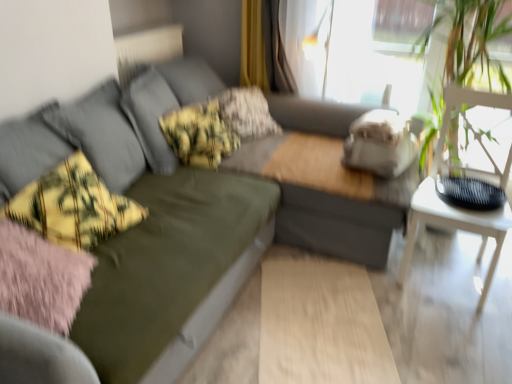
Measure the distance between point (417, 197) and camera.

Point (417, 197) is 2.08 meters from camera.

You are a GUI agent. You are given a task and a screenshot of the screen. Output one action in this format:
    pyautogui.click(x=<x>, y=<y>)
    Task: Click on the yellow-green plaid throw pillow at left
    
    Given the screenshot: What is the action you would take?
    pyautogui.click(x=73, y=206)

Describe the element at coordinates (72, 142) in the screenshot. I see `olive green fabric couch at center` at that location.

What is the approximate height of olive green fabric couch at center?

olive green fabric couch at center is 37.23 inches tall.

In order to face floral fabric pillow at center, acting as the 1th pillow starting from the back, should I rotate leftwards or rightwards?

You should look left and rotate roughly 1.478 degrees.

This screenshot has height=384, width=512. I want to click on yellow-green plaid pillow at center, which is the 2th pillow from back to front, so click(x=199, y=134).

What do you see at coordinates (264, 48) in the screenshot? I see `yellow fabric curtain at upper center` at bounding box center [264, 48].

The image size is (512, 384). I want to click on white wooden table at right, so click(455, 227).

Is yellow fabric curtain at upper center bigger than white textured radiator at upper left?

No.

Can you tell me how much yellow fabric curtain at upper center and white textured radiator at upper left differ in facing direction?

The angle between the facing direction of yellow fabric curtain at upper center and the facing direction of white textured radiator at upper left is 88.9 degrees.

Does yellow fabric curtain at upper center have a greater height compared to white textured radiator at upper left?

Indeed, yellow fabric curtain at upper center has a greater height compared to white textured radiator at upper left.

This screenshot has height=384, width=512. Find the location of `the 2nd pillow below when counting from the white textured radiator at upper left (from the image's perspective)`. the 2nd pillow below when counting from the white textured radiator at upper left (from the image's perspective) is located at coordinates (199, 134).

Which of these two, white textured radiator at upper left or yellow-green plaid pillow at center, which is the 2th pillow from back to front, is wider?

Wider between the two is yellow-green plaid pillow at center, which is the 2th pillow from back to front.

Is white textured radiator at upper left turned away from yellow-green plaid pillow at center, the 1th pillow in the front-to-back sequence?

No, white textured radiator at upper left's orientation is not away from yellow-green plaid pillow at center, the 1th pillow in the front-to-back sequence.

Does white textured radiator at upper left have a larger size compared to yellow-green plaid pillow at center, which is the 2th pillow from back to front?

No, white textured radiator at upper left is not bigger than yellow-green plaid pillow at center, which is the 2th pillow from back to front.

Which of these two, olive green fabric couch at center or yellow-green plaid throw pillow at left, is wider?

With larger width is olive green fabric couch at center.

Between olive green fabric couch at center and yellow-green plaid throw pillow at left, which one has smaller size?

With smaller size is yellow-green plaid throw pillow at left.

Does olive green fabric couch at center come in front of yellow-green plaid throw pillow at left?

No, olive green fabric couch at center is further to the viewer.

Considering the sizes of objects olive green fabric couch at center and floral fabric pillow at center, marked as the 2th pillow in a front-to-back arrangement, in the image provided, who is thinner, olive green fabric couch at center or floral fabric pillow at center, marked as the 2th pillow in a front-to-back arrangement,?

With smaller width is floral fabric pillow at center, marked as the 2th pillow in a front-to-back arrangement.

Is point (351, 114) in front of point (256, 135)?

That is False.

From a real-world perspective, relative to floral fabric pillow at center, acting as the 1th pillow starting from the back, is olive green fabric couch at center vertically above or below?

olive green fabric couch at center is situated lower than floral fabric pillow at center, acting as the 1th pillow starting from the back, in the real world.

Is yellow-green plaid pillow at center, the 1th pillow in the front-to-back sequence, behind yellow fabric curtain at upper center?

No, it is in front of yellow fabric curtain at upper center.

Is yellow-green plaid pillow at center, the 1th pillow in the front-to-back sequence, wider or thinner than yellow fabric curtain at upper center?

In the image, yellow-green plaid pillow at center, the 1th pillow in the front-to-back sequence, appears to be wider than yellow fabric curtain at upper center.

Is yellow-green plaid pillow at center, which is the 2th pillow from back to front, oriented away from yellow fabric curtain at upper center?

No, yellow fabric curtain at upper center is not at the back of yellow-green plaid pillow at center, which is the 2th pillow from back to front.

Can you confirm if yellow-green plaid pillow at center, the 1th pillow in the front-to-back sequence, is positioned to the right of yellow fabric curtain at upper center?

In fact, yellow-green plaid pillow at center, the 1th pillow in the front-to-back sequence, is to the left of yellow fabric curtain at upper center.

Between olive green fabric couch at center and white wooden table at right, which one has larger size?

Bigger between the two is olive green fabric couch at center.

Considering the relative positions of olive green fabric couch at center and white wooden table at right in the image provided, is olive green fabric couch at center to the left or to the right of white wooden table at right?

From the image, it's evident that olive green fabric couch at center is to the left of white wooden table at right.

Is olive green fabric couch at center completely or partially outside of white wooden table at right?

Yes, olive green fabric couch at center is not within white wooden table at right.

Is olive green fabric couch at center taller than white wooden table at right?

Yes.

In terms of height, does yellow fabric curtain at upper center look taller or shorter compared to olive green fabric couch at center?

Considering their sizes, yellow fabric curtain at upper center has less height than olive green fabric couch at center.

From the image's perspective, between yellow fabric curtain at upper center and olive green fabric couch at center, who is located below?

olive green fabric couch at center.

From the picture: Is yellow fabric curtain at upper center at the right side of olive green fabric couch at center?

Incorrect, yellow fabric curtain at upper center is not on the right side of olive green fabric couch at center.

From a real-world perspective, is yellow fabric curtain at upper center under olive green fabric couch at center?

No.

Where is `curtain behind the white textured radiator at upper left`? curtain behind the white textured radiator at upper left is located at coordinates (264, 48).

Identify the location of radiator lying above the yellow-green plaid pillow at center, the 1th pillow in the front-to-back sequence (from the image's perspective). This screenshot has height=384, width=512. (146, 49).

From the image, which object appears to be farther from yellow-green plaid pillow at center, the 1th pillow in the front-to-back sequence, olive green fabric couch at center or white wooden table at right?

white wooden table at right is further to yellow-green plaid pillow at center, the 1th pillow in the front-to-back sequence.

Looking at the image, which one is located closer to olive green fabric couch at center, white wooden table at right or yellow fabric curtain at upper center?

white wooden table at right lies closer to olive green fabric couch at center than the other object.

Estimate the real-world distances between objects in this image. Which object is further from olive green fabric couch at center, yellow-green plaid pillow at center, which is the 2th pillow from back to front, or yellow-green plaid throw pillow at left?

yellow-green plaid throw pillow at left is further to olive green fabric couch at center.

Considering their positions, is floral fabric pillow at center, marked as the 2th pillow in a front-to-back arrangement, positioned closer to white wooden table at right than yellow fabric curtain at upper center?

floral fabric pillow at center, marked as the 2th pillow in a front-to-back arrangement, is closer to white wooden table at right.

Estimate the real-world distances between objects in this image. Which object is further from yellow-green plaid pillow at center, the 1th pillow in the front-to-back sequence, floral fabric pillow at center, acting as the 1th pillow starting from the back, or yellow-green plaid throw pillow at left?

yellow-green plaid throw pillow at left is further to yellow-green plaid pillow at center, the 1th pillow in the front-to-back sequence.

From the image, which object appears to be farther from olive green fabric couch at center, white textured radiator at upper left or yellow fabric curtain at upper center?

white textured radiator at upper left is further to olive green fabric couch at center.

When comparing their distances from yellow-green plaid pillow at center, which is the 2th pillow from back to front, does olive green fabric couch at center or floral fabric pillow at center, acting as the 1th pillow starting from the back, seem further?

olive green fabric couch at center.

When comparing their distances from floral fabric pillow at center, acting as the 1th pillow starting from the back, does yellow-green plaid throw pillow at left or white textured radiator at upper left seem further?

yellow-green plaid throw pillow at left is further to floral fabric pillow at center, acting as the 1th pillow starting from the back.

This screenshot has width=512, height=384. Find the location of `couch between white textured radiator at upper left and white wooden table at right`. couch between white textured radiator at upper left and white wooden table at right is located at coordinates (326, 184).

I want to click on curtain situated between white textured radiator at upper left and white wooden table at right from left to right, so click(264, 48).

Find the location of `throw pillow located between olive green fabric couch at center and white textured radiator at upper left in the depth direction`. throw pillow located between olive green fabric couch at center and white textured radiator at upper left in the depth direction is located at coordinates (73, 206).

Identify the location of table between olive green fabric couch at center and white textured radiator at upper left in the front-back direction. The width and height of the screenshot is (512, 384). (455, 227).